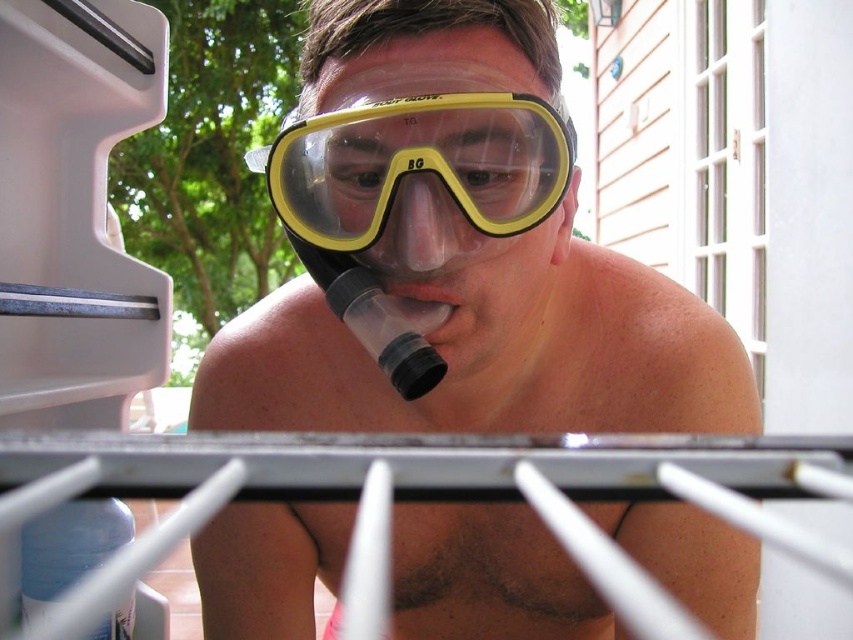
Question: Based on their relative distances, which object is nearer to the clear plastic goggles at center?

Choices:
 (A) yellow clear plastic goggles at center
 (B) yellow matte snorkel mask at center
 (C) translucent rubber nose at center

Answer: (B)

Question: Where is yellow matte snorkel mask at center located in relation to translucent rubber nose at center in the image?

Choices:
 (A) above
 (B) below

Answer: (A)

Question: Is clear plastic goggles at center smaller than yellow matte snorkel mask at center?

Choices:
 (A) no
 (B) yes

Answer: (A)

Question: Estimate the real-world distances between objects in this image. Which object is closer to the yellow clear plastic goggles at center?

Choices:
 (A) translucent rubber nose at center
 (B) yellow matte snorkel mask at center

Answer: (B)

Question: Which object appears closest to the camera in this image?

Choices:
 (A) yellow matte snorkel mask at center
 (B) clear plastic goggles at center
 (C) translucent rubber nose at center

Answer: (A)

Question: Does clear plastic goggles at center have a larger size compared to yellow matte snorkel mask at center?

Choices:
 (A) no
 (B) yes

Answer: (B)